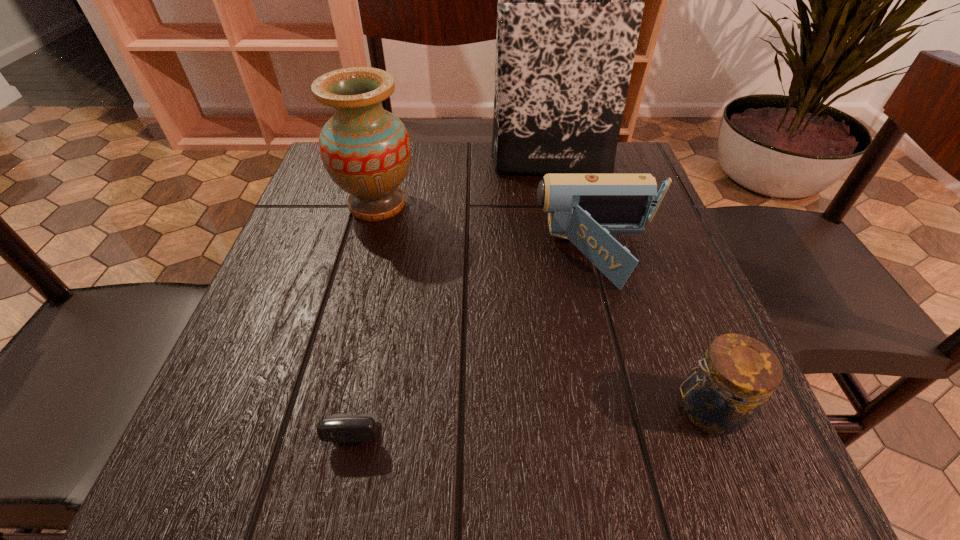
Identify the location of the farthest object. (569, 11).

Image resolution: width=960 pixels, height=540 pixels. In order to click on shopping bag in this screenshot , I will do `click(569, 11)`.

Identify the location of vase. (366, 150).

Find the location of a particular element. camcorder is located at coordinates (585, 208).

The height and width of the screenshot is (540, 960). I want to click on jar, so click(x=725, y=390).

This screenshot has width=960, height=540. Identify the location of the shortest object. (344, 428).

Identify the location of vacant space located on the front of the tallest object with the design. The width and height of the screenshot is (960, 540). (578, 303).

The image size is (960, 540). In order to click on blank space located on the back of the vase in this screenshot , I will do `click(395, 141)`.

This screenshot has width=960, height=540. Identify the location of vacant area situated on the side of the camcorder with the flip-out screen. (461, 256).

You are a GUI agent. You are given a task and a screenshot of the screen. Output one action in this format:
    pyautogui.click(x=<x>, y=<y>)
    Task: Click on the free spot located on the side of the camcorder with the flip-out screen
    The height and width of the screenshot is (540, 960).
    Given the screenshot: What is the action you would take?
    (x=348, y=256)